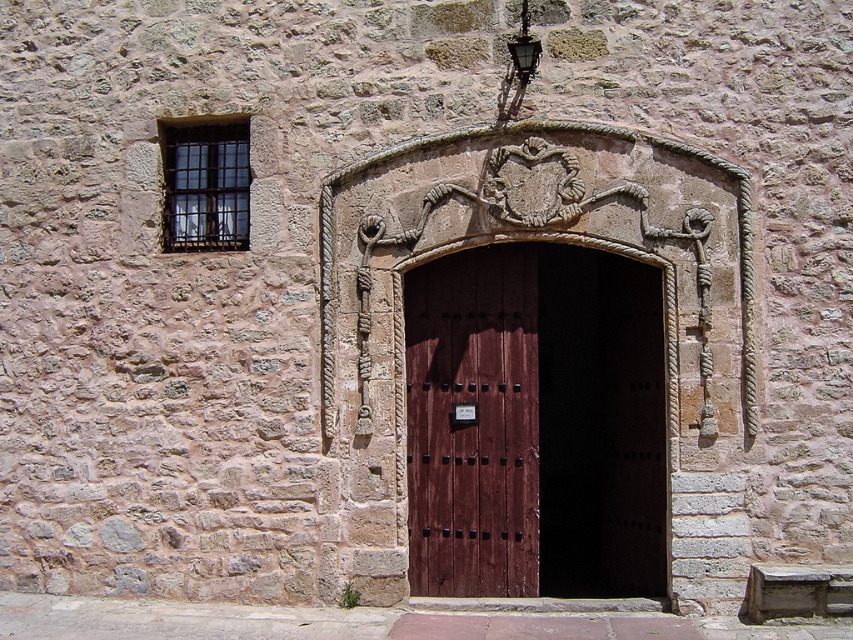
You are standing at the entrance of the stone building and want to open the dark wood door at center. If your arm can reach up to 2 meters, can you reach the door handle without moving closer?

The dark wood door at center is 6.77 meters away from the viewer. Since your arm can only reach up to 2 meters, you cannot reach the door handle without moving closer.

You are standing at the entrance of a historical stone building and see the dark wood door at center. If you were to walk directly towards the door, which direction should you move relative to your current position?

Since the dark wood door at center is positioned at point 0.662 on the x and 0.628 on the y coordinate, you should move straight ahead towards the center of the entrance to reach it.